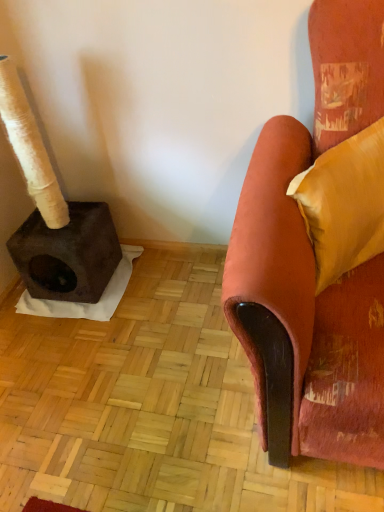
Question: Does velvet orange armchair at right have a greater height compared to velvet yellow pillow at right?

Choices:
 (A) no
 (B) yes

Answer: (B)

Question: Is velvet orange armchair at right located outside velvet yellow pillow at right?

Choices:
 (A) yes
 (B) no

Answer: (A)

Question: Is velvet orange armchair at right at the right side of velvet yellow pillow at right?

Choices:
 (A) no
 (B) yes

Answer: (A)

Question: Can you confirm if velvet orange armchair at right is thinner than velvet yellow pillow at right?

Choices:
 (A) no
 (B) yes

Answer: (A)

Question: Is velvet orange armchair at right facing away from velvet yellow pillow at right?

Choices:
 (A) yes
 (B) no

Answer: (A)

Question: Can you see velvet orange armchair at right touching velvet yellow pillow at right?

Choices:
 (A) yes
 (B) no

Answer: (B)

Question: Is velvet yellow pillow at right to the left of velvet orange armchair at right from the viewer's perspective?

Choices:
 (A) yes
 (B) no

Answer: (B)

Question: Considering the relative sizes of velvet yellow pillow at right and velvet orange armchair at right in the image provided, is velvet yellow pillow at right thinner than velvet orange armchair at right?

Choices:
 (A) yes
 (B) no

Answer: (A)

Question: From a real-world perspective, is velvet yellow pillow at right located higher than velvet orange armchair at right?

Choices:
 (A) no
 (B) yes

Answer: (B)

Question: Does velvet yellow pillow at right appear on the right side of velvet orange armchair at right?

Choices:
 (A) no
 (B) yes

Answer: (B)

Question: Considering the relative sizes of velvet yellow pillow at right and velvet orange armchair at right in the image provided, is velvet yellow pillow at right smaller than velvet orange armchair at right?

Choices:
 (A) no
 (B) yes

Answer: (B)

Question: Is velvet yellow pillow at right looking in the opposite direction of velvet orange armchair at right?

Choices:
 (A) no
 (B) yes

Answer: (B)

Question: Considering the relative positions of velvet yellow pillow at right and velvet orange armchair at right in the image provided, is velvet yellow pillow at right to the left or to the right of velvet orange armchair at right?

Choices:
 (A) right
 (B) left

Answer: (A)